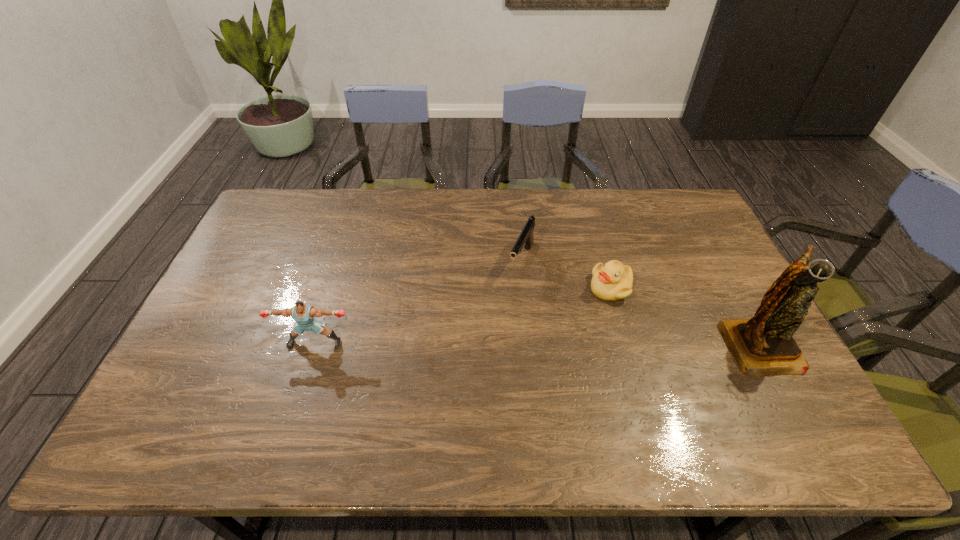
Find the location of `free space on the desktop that is between the leftmost object and the rightmost object and is positioned at the muzzle of the second object from left to right`. free space on the desktop that is between the leftmost object and the rightmost object and is positioned at the muzzle of the second object from left to right is located at coordinates (481, 343).

Find the location of `vacant space on the desktop that is between the puncher and the rightmost object and is positioned on the front-facing side of the second object from right to left`. vacant space on the desktop that is between the puncher and the rightmost object and is positioned on the front-facing side of the second object from right to left is located at coordinates (582, 343).